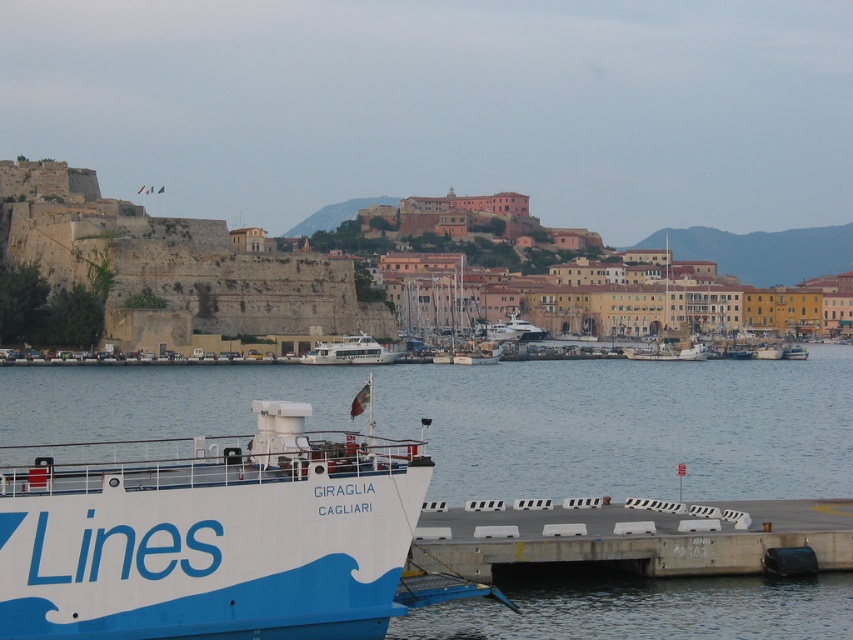
You are a delivery drone with a wingspan of 1.5 meters. You need to fly from the white matte ship at lower left to the concrete at lower right. Is there enough space between them for your drone to pass through?

The distance between the white matte ship at lower left and the concrete at lower right is 9.53 meters, which is more than enough for the drone with a 1.5 meter wingspan to pass safely.

You are a harbor pilot trying to navigate a new ship into the harbor. The white matte ship at lower left is currently blocking your path. Based on its position coordinates, can you determine if it will interfere with your planned route that requires a clearance zone of 0.2 units from the origin point?

The white matte ship at lower left is located at coordinates point [207,532]. Since the clearance zone requires 0.2 units from the origin point, the ship is outside this zone and will not interfere with the planned route.

You are standing at the point marked as point (207, 532) in the harbor scene. What object is located exactly at that coordinate?

The white matte ship at lower left is located exactly at point (207, 532).